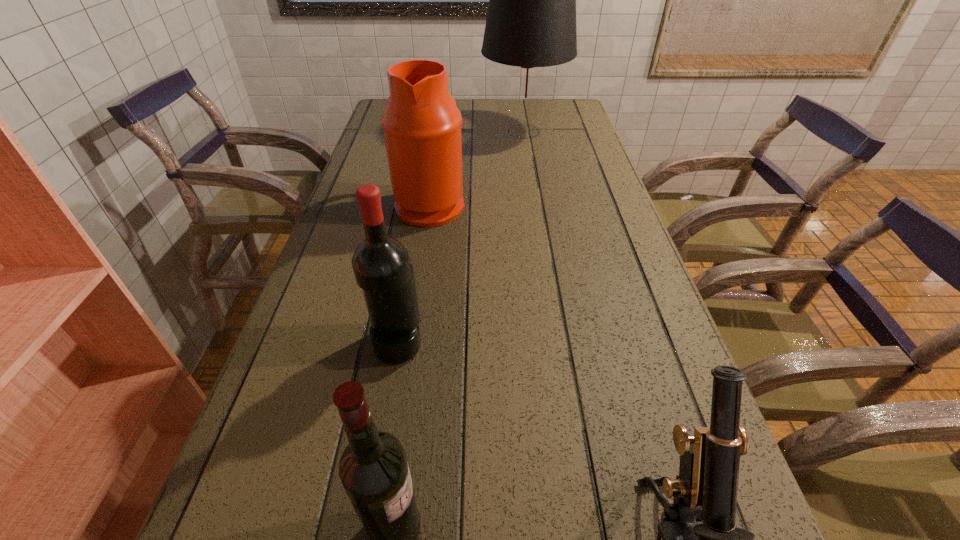
Find the location of `the farthest object`. the farthest object is located at coordinates (531, 21).

Where is `the tallest object`? the tallest object is located at coordinates (531, 21).

The image size is (960, 540). Identify the location of the second farthest object. (421, 123).

At what (x,y) coordinates should I click in order to perform the action: click on the third farthest object. Please return your answer as a coordinate pair (x, y). The image size is (960, 540). Looking at the image, I should click on (381, 264).

Where is `vacant space located on the left of the farthest object`? The width and height of the screenshot is (960, 540). vacant space located on the left of the farthest object is located at coordinates (455, 131).

In order to click on free region located from the spout of the second farthest object in this screenshot , I will do `click(501, 204)`.

Locate an element on the screen. The width and height of the screenshot is (960, 540). free space located 0.340m on the back of the third farthest object is located at coordinates (419, 223).

Identify the location of object at the far edge. This screenshot has height=540, width=960. (531, 21).

In order to click on object located in the left edge section of the desktop in this screenshot , I will do `click(421, 123)`.

You are a GUI agent. You are given a task and a screenshot of the screen. Output one action in this format:
    pyautogui.click(x=<x>, y=<y>)
    Task: Click on the object located in the right edge section of the desktop
    
    Given the screenshot: What is the action you would take?
    pyautogui.click(x=531, y=21)